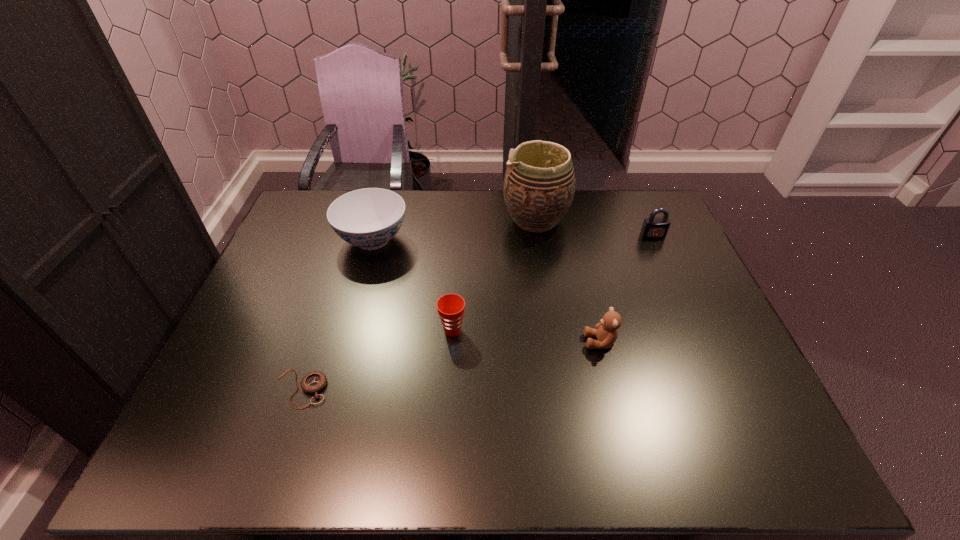
Where is `vacant point located between the tallest object and the chinaware`? vacant point located between the tallest object and the chinaware is located at coordinates (454, 230).

The height and width of the screenshot is (540, 960). What are the coordinates of `free space between the third object from left to right and the padlock` in the screenshot? It's located at (553, 283).

Find the location of a particular element. This screenshot has width=960, height=540. free area in between the rightmost object and the teddy bear is located at coordinates (627, 288).

The width and height of the screenshot is (960, 540). Find the location of `free point between the third object from left to right and the tallest object`. free point between the third object from left to right and the tallest object is located at coordinates (494, 275).

I want to click on free space that is in between the nearest object and the chinaware, so click(337, 314).

Identify which object is the fifth nearest to the nearest object. Please provide its 2D coordinates. Your answer should be formatted as a tuple, i.e. [(x, y)], where the tuple contains the x and y coordinates of a point satisfying the conditions above.

[(653, 227)]

Where is `object that can be found as the fourth closest to the rightmost object`? object that can be found as the fourth closest to the rightmost object is located at coordinates (368, 218).

Where is `vacant area in the image that satisfies the following two spatial constraints: 1. on the back side of the pocket watch; 2. on the right side of the fourth object from right to left`? Image resolution: width=960 pixels, height=540 pixels. vacant area in the image that satisfies the following two spatial constraints: 1. on the back side of the pocket watch; 2. on the right side of the fourth object from right to left is located at coordinates (321, 330).

Identify the location of vacant area that satisfies the following two spatial constraints: 1. on the back side of the pocket watch; 2. on the left side of the tallest object. This screenshot has width=960, height=540. (357, 220).